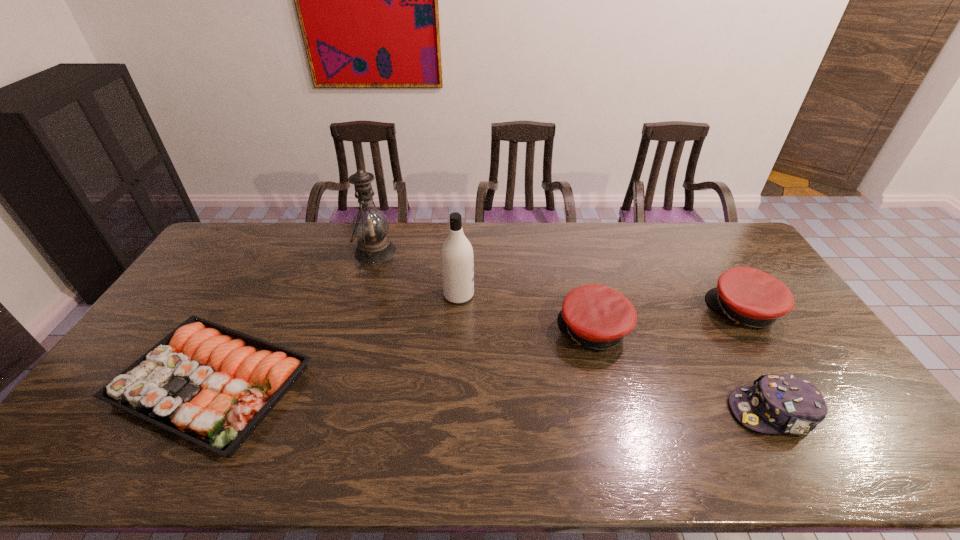
The image size is (960, 540). I want to click on vacant area situated 0.060m on the front-facing side of the nearest headwear, so click(x=708, y=413).

This screenshot has height=540, width=960. I want to click on free space located 0.230m on the front-facing side of the nearest headwear, so click(x=640, y=413).

At what (x,y) coordinates should I click in order to perform the action: click on vacant position located 0.260m on the front-facing side of the nearest headwear. Please return your answer as a coordinate pair (x, y). Looking at the image, I should click on (629, 413).

This screenshot has height=540, width=960. Identify the location of vacant region located on the back of the platter. (273, 273).

The width and height of the screenshot is (960, 540). I want to click on object at the far edge, so click(x=370, y=226).

The width and height of the screenshot is (960, 540). Find the location of `headwear at the near edge`. headwear at the near edge is located at coordinates click(x=776, y=403).

Locate an element on the screen. Image resolution: width=960 pixels, height=540 pixels. platter located in the near edge section of the desktop is located at coordinates (212, 385).

Where is `object that is at the left edge`? object that is at the left edge is located at coordinates (212, 385).

This screenshot has height=540, width=960. I want to click on object located in the near left corner section of the desktop, so click(x=212, y=385).

At what (x,y) coordinates should I click in order to perform the action: click on object that is at the near right corner. Please return your answer as a coordinate pair (x, y). Looking at the image, I should click on (776, 403).